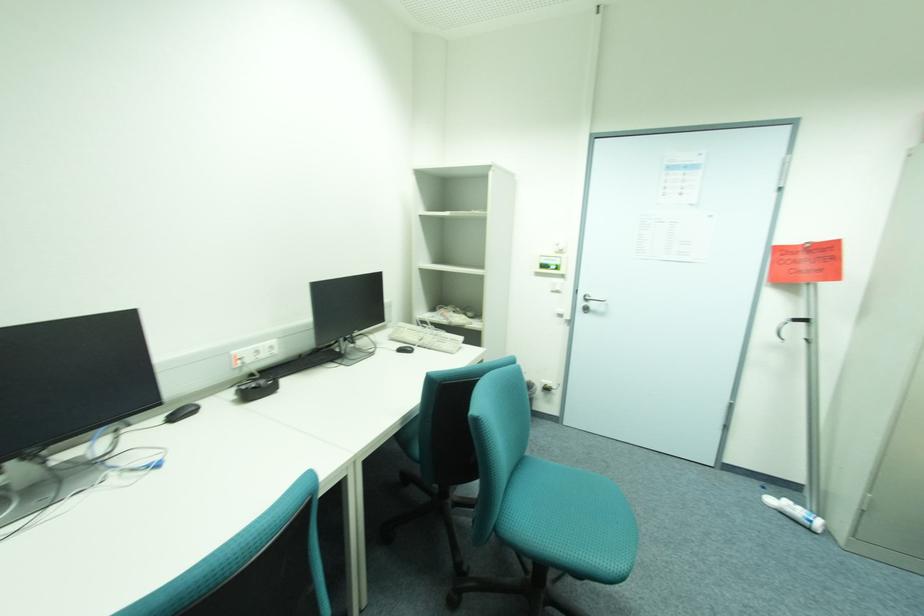
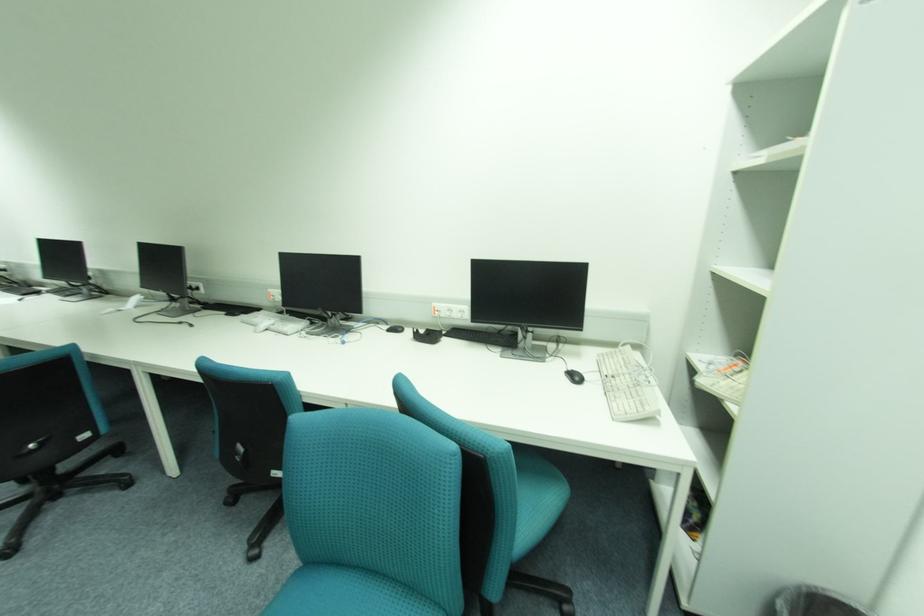
In the second image, find the point that corresponds to the point at 417,350 in the first image.

(584, 379)